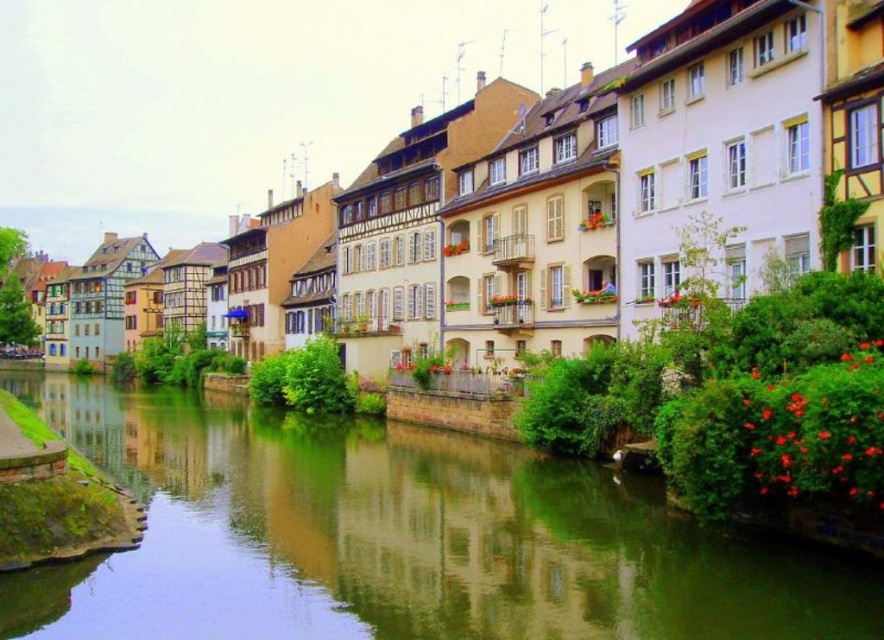
Question: Can you confirm if green stone river at center is positioned below matte beige building at center?

Choices:
 (A) no
 (B) yes

Answer: (B)

Question: Does green stone river at center appear over matte beige building at center?

Choices:
 (A) yes
 (B) no

Answer: (B)

Question: From the image, what is the correct spatial relationship of green stone river at center in relation to matte beige building at center?

Choices:
 (A) above
 (B) below

Answer: (B)

Question: Among these points, which one is farthest from the camera?

Choices:
 (A) (644, 616)
 (B) (612, 1)

Answer: (B)